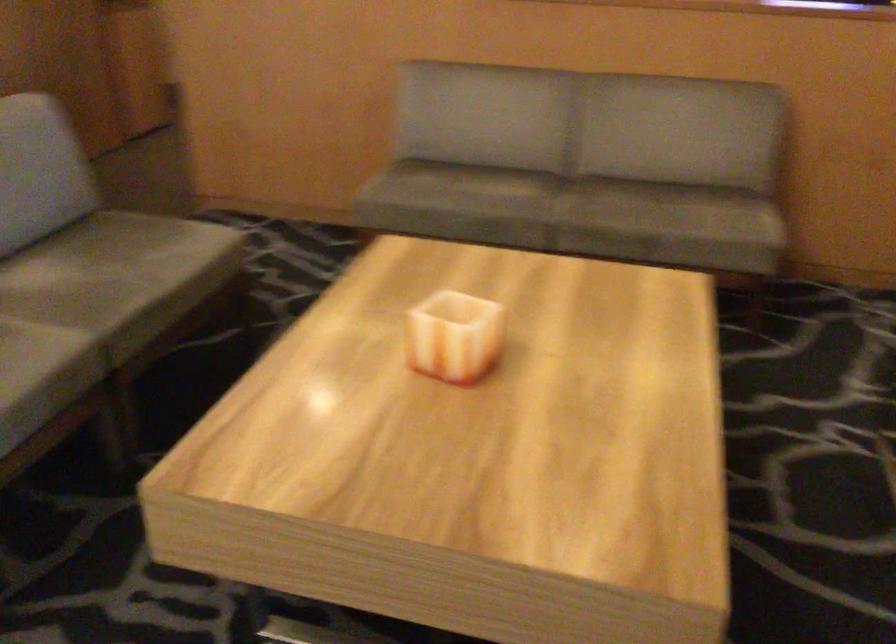
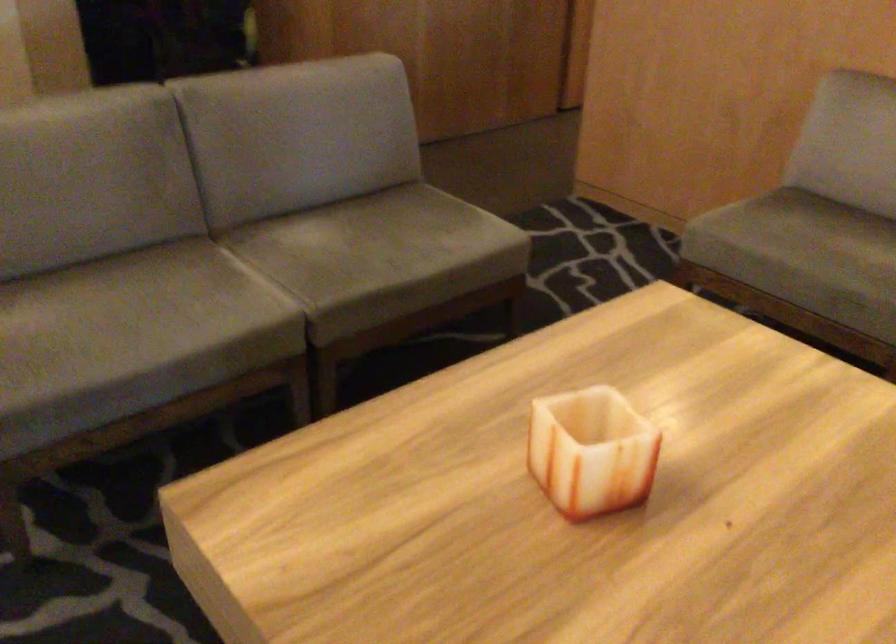
Where in the second image is the point corresponding to point 451,194 from the first image?

(798, 245)